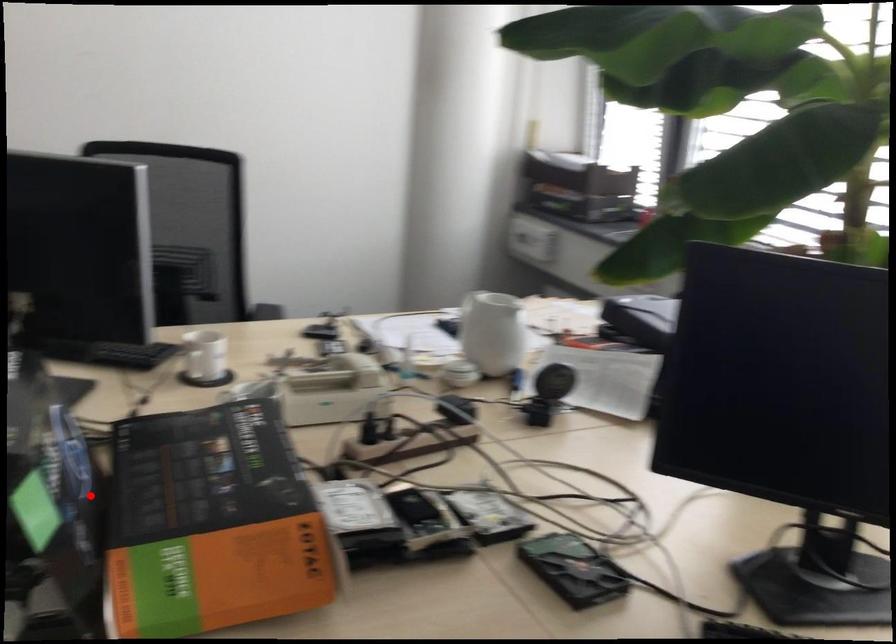
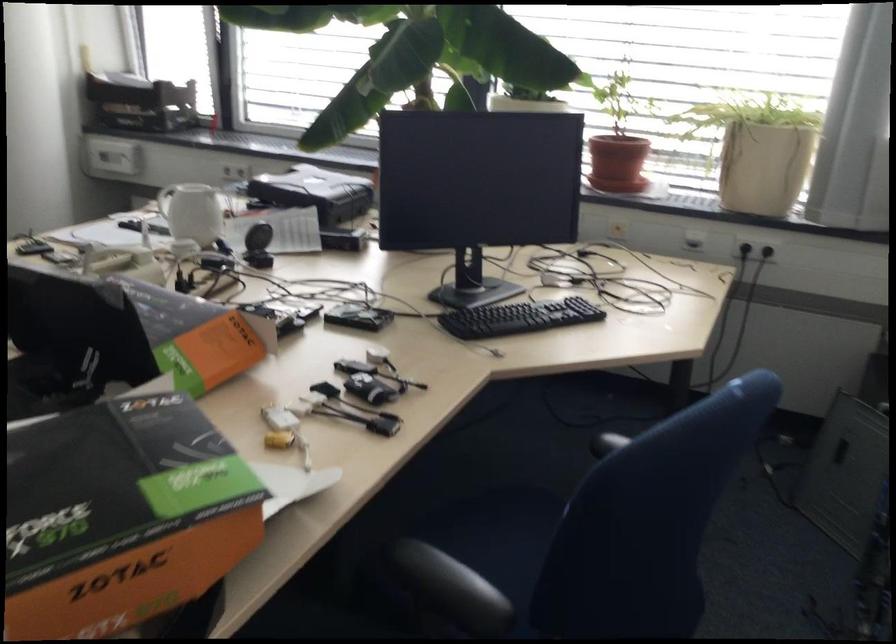
Question: I am providing you with two images of the same scene from different viewpoints. Image1 has a red point marked. In image2, the corresponding 3D location appears at what relative position? Reply with the corresponding letter.

Choices:
 (A) Closer
 (B) Farther

Answer: (B)